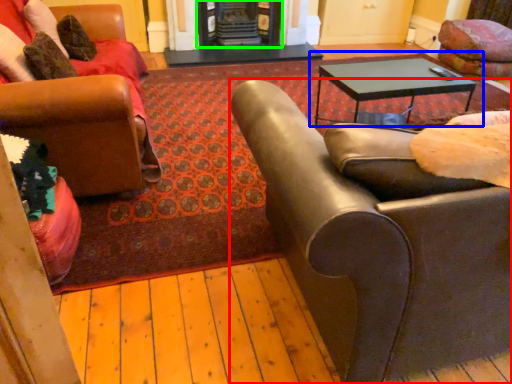
Question: Considering the real-world distances, which object is closest to chair (highlighted by a red box)? coffee table (highlighted by a blue box) or fireplace (highlighted by a green box).

Choices:
 (A) coffee table
 (B) fireplace

Answer: (A)